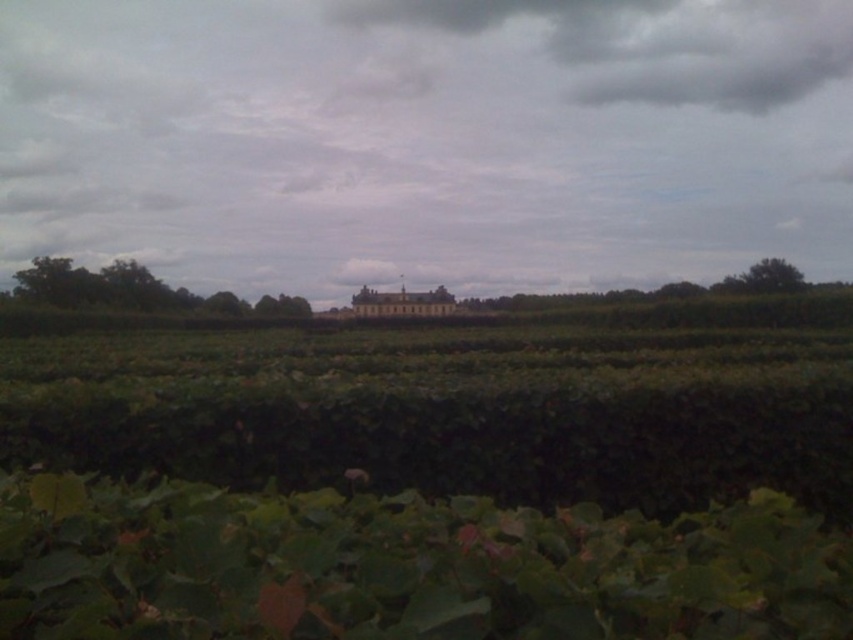
Is gray fluffy cloud at upper center positioned before green leafy vegetation at center?

No, gray fluffy cloud at upper center is further to the viewer.

Is gray fluffy cloud at upper center further to camera compared to green leafy vegetation at center?

Yes, it is.

Image resolution: width=853 pixels, height=640 pixels. In order to click on gray fluffy cloud at upper center in this screenshot , I will do `click(659, 44)`.

You are a GUI agent. You are given a task and a screenshot of the screen. Output one action in this format:
    pyautogui.click(x=<x>, y=<y>)
    Task: Click on the gray fluffy cloud at upper center
    Image resolution: width=853 pixels, height=640 pixels.
    Given the screenshot: What is the action you would take?
    (659, 44)

In the scene shown: Can you confirm if green leafy vegetation at center is positioned to the right of golden stone palace at center?

No, green leafy vegetation at center is not to the right of golden stone palace at center.

Can you confirm if green leafy vegetation at center is smaller than golden stone palace at center?

Incorrect, green leafy vegetation at center is not smaller in size than golden stone palace at center.

Where is `green leafy vegetation at center`? This screenshot has width=853, height=640. green leafy vegetation at center is located at coordinates (136, 291).

Is gray cloudy sky at center bigger than green leafy vegetation at center?

Indeed, gray cloudy sky at center has a larger size compared to green leafy vegetation at center.

Which is behind, point (268, 276) or point (109, 269)?

The point (268, 276) is behind.

This screenshot has height=640, width=853. In order to click on gray cloudy sky at center in this screenshot , I will do `click(427, 140)`.